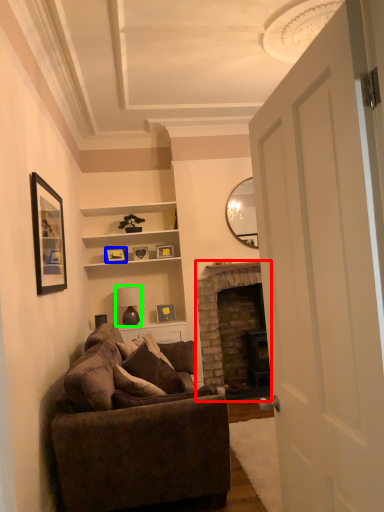
Question: Based on their relative distances, which object is farther from fireplace (highlighted by a red box)? Choose from picture frame (highlighted by a blue box) and lamp (highlighted by a green box).

Choices:
 (A) picture frame
 (B) lamp

Answer: (A)